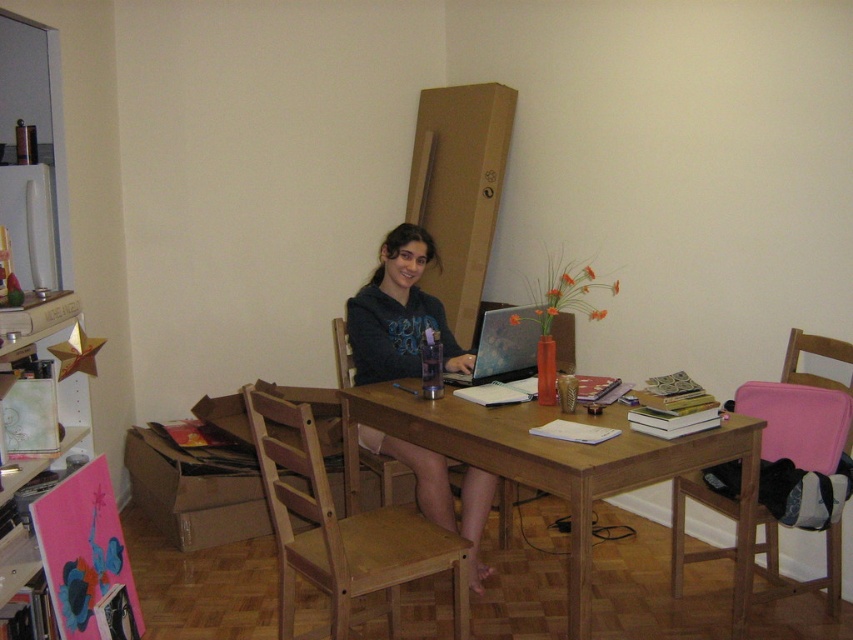
Who is lower down, wooden table at center or matte black hoodie at center?

Positioned lower is wooden table at center.

Can you confirm if wooden table at center is positioned to the left of matte black hoodie at center?

No, wooden table at center is not to the left of matte black hoodie at center.

Image resolution: width=853 pixels, height=640 pixels. I want to click on wooden table at center, so click(x=560, y=467).

From the picture: Can you confirm if matte black hoodie at center is thinner than wooden chair at center?

No, matte black hoodie at center is not thinner than wooden chair at center.

Who is positioned more to the left, matte black hoodie at center or wooden chair at center?

From the viewer's perspective, wooden chair at center appears more on the left side.

The image size is (853, 640). What are the coordinates of `matte black hoodie at center` in the screenshot? It's located at (398, 314).

Can you confirm if wooden table at center is positioned to the right of light wood chair at center?

Indeed, wooden table at center is positioned on the right side of light wood chair at center.

Which of these two, wooden table at center or light wood chair at center, stands taller?

light wood chair at center

The image size is (853, 640). Find the location of `wooden table at center`. wooden table at center is located at coordinates (560, 467).